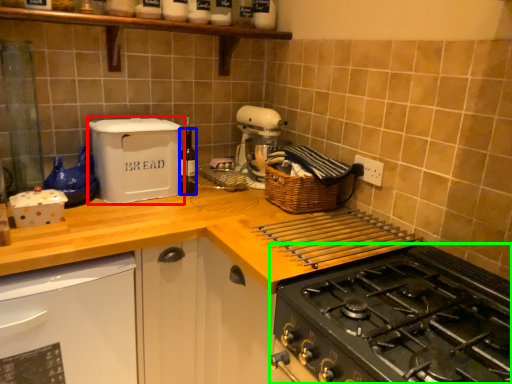
Question: Which is farther away from kitchen appliance (highlighted by a red box)? bottle (highlighted by a blue box) or gas stove (highlighted by a green box)?

Choices:
 (A) bottle
 (B) gas stove

Answer: (B)